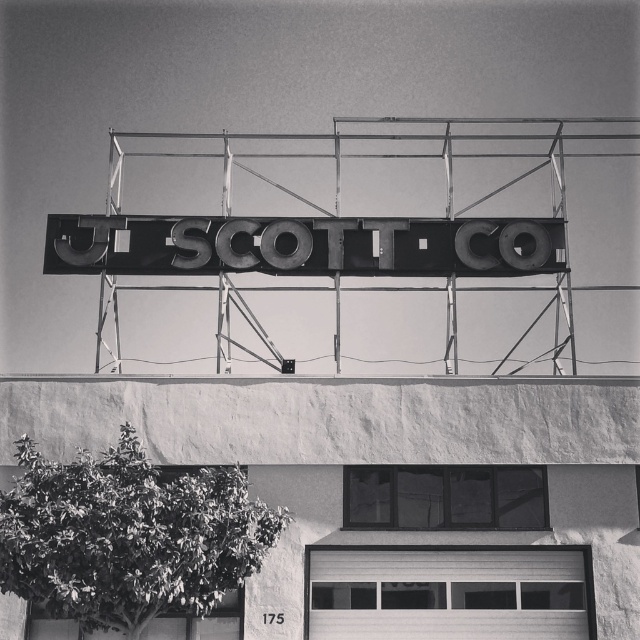
Question: Can you confirm if metallic letters at center is wider than smooth white garage door at lower center?

Choices:
 (A) yes
 (B) no

Answer: (A)

Question: Which point is closer to the camera taking this photo?

Choices:
 (A) 454,611
 (B) 380,248

Answer: (A)

Question: Can you confirm if metallic letters at center is bigger than smooth white garage door at lower center?

Choices:
 (A) no
 (B) yes

Answer: (B)

Question: Which point is closer to the camera taking this photo?

Choices:
 (A) (472, 224)
 (B) (461, 602)

Answer: (B)

Question: Does metallic letters at center have a smaller size compared to smooth white garage door at lower center?

Choices:
 (A) yes
 (B) no

Answer: (B)